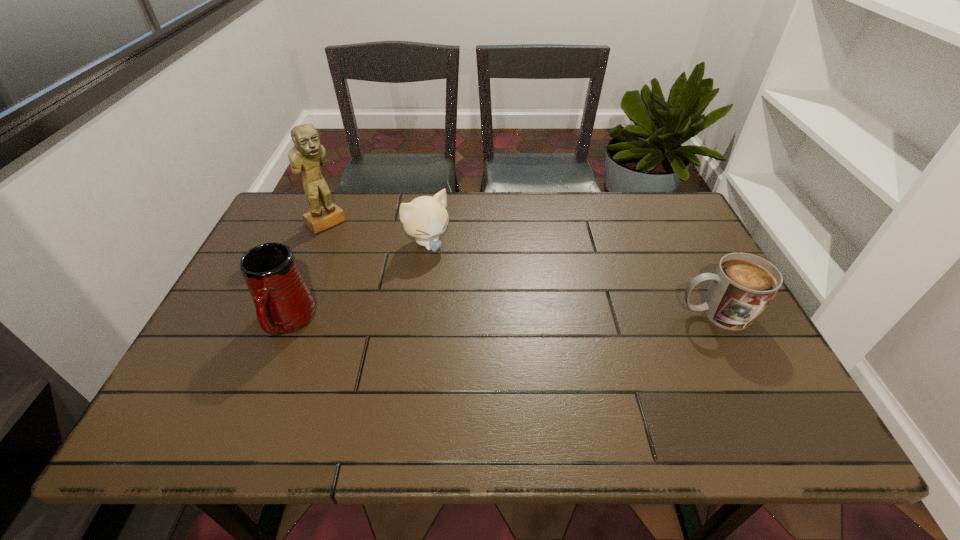
This screenshot has height=540, width=960. What are the coordinates of `vacant space on the desktop that is between the left mug and the rightmost object and is positioned on the face of the third object from left to right` in the screenshot? It's located at (493, 318).

Locate an element on the screen. free spot on the desktop that is between the left mug and the rightmost object and is positioned on the front-facing side of the tallest object is located at coordinates pyautogui.click(x=440, y=319).